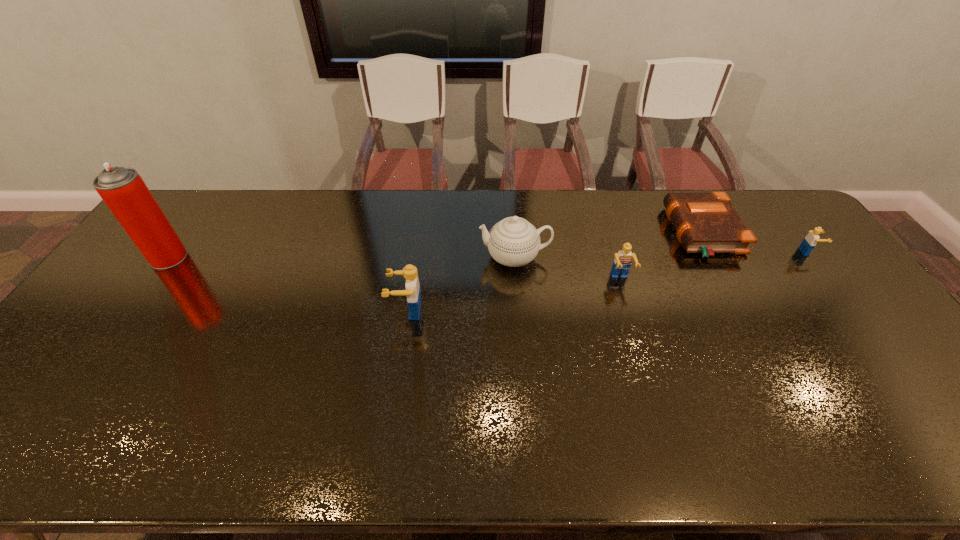
Locate an element on the screen. This screenshot has width=960, height=540. free space located on the spine side of the fifth object from left to right is located at coordinates click(652, 233).

Locate an element on the screen. This screenshot has width=960, height=540. vacant space located on the spine side of the fifth object from left to right is located at coordinates (646, 233).

The image size is (960, 540). What are the coordinates of `object that is positioned at the far edge` in the screenshot? It's located at (707, 223).

This screenshot has height=540, width=960. I want to click on object situated at the left edge, so click(122, 189).

This screenshot has width=960, height=540. In order to click on object that is at the right edge in this screenshot , I will do `click(809, 242)`.

Identify the location of blank space at the far edge of the desktop. (629, 214).

In the image, there is a desktop. Where is `vacant space at the near edge`? vacant space at the near edge is located at coordinates (319, 396).

What are the coordinates of `free space at the left edge` in the screenshot? It's located at (104, 325).

Locate an element on the screen. Image resolution: width=960 pixels, height=540 pixels. vacant space at the right edge is located at coordinates (837, 323).

Where is `vacant region at the far left corner`? The width and height of the screenshot is (960, 540). vacant region at the far left corner is located at coordinates (189, 191).